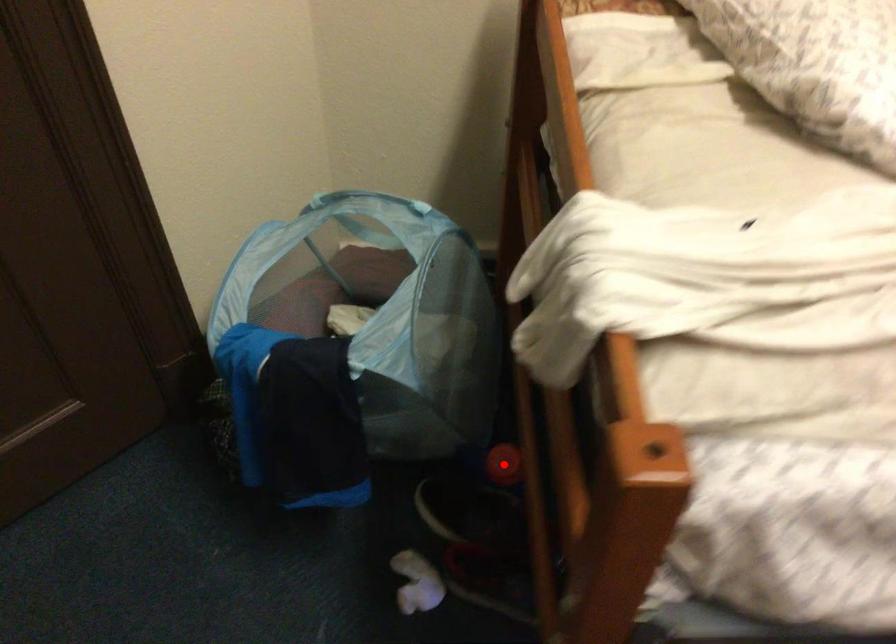
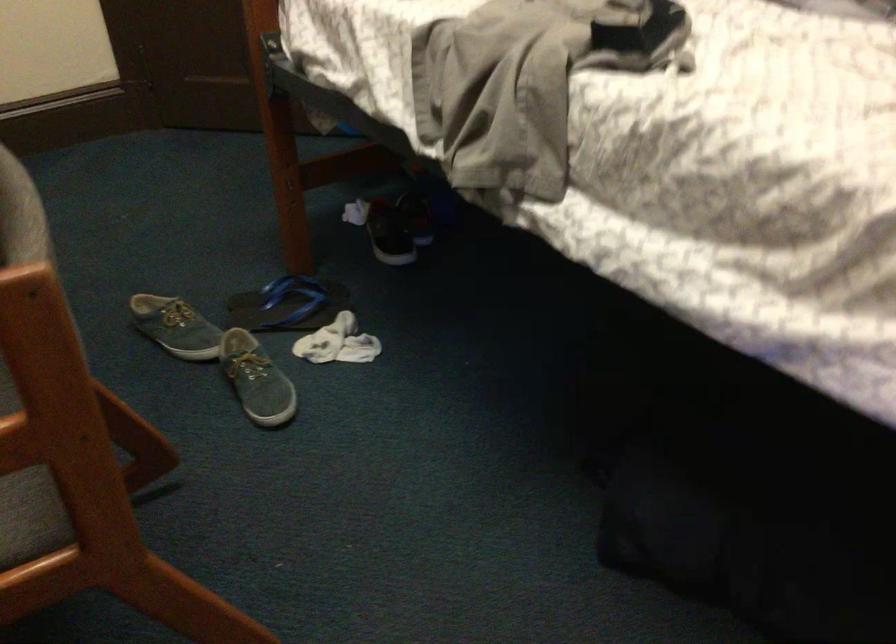
Question: I am providing you with two images of the same scene from different viewpoints. A red point is marked on the first image. At the location where the point appears in image 1, is it still visible in image 2?

Choices:
 (A) Yes
 (B) No

Answer: (B)